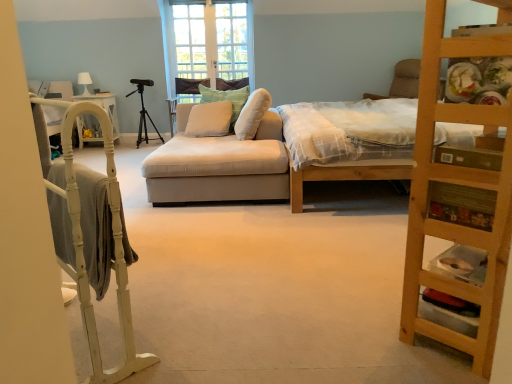
Identify the location of vacant space to the left of wooden ladder at right. (352, 320).